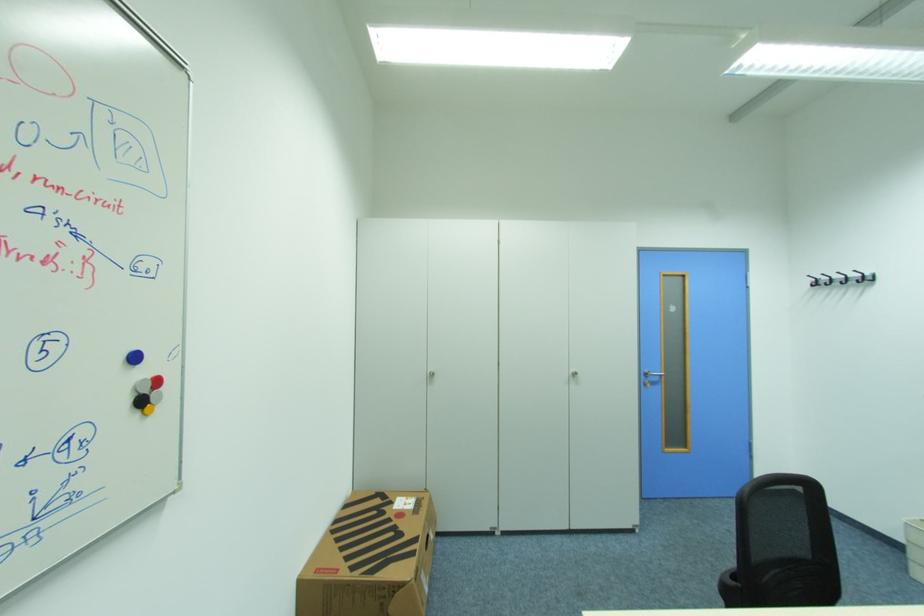
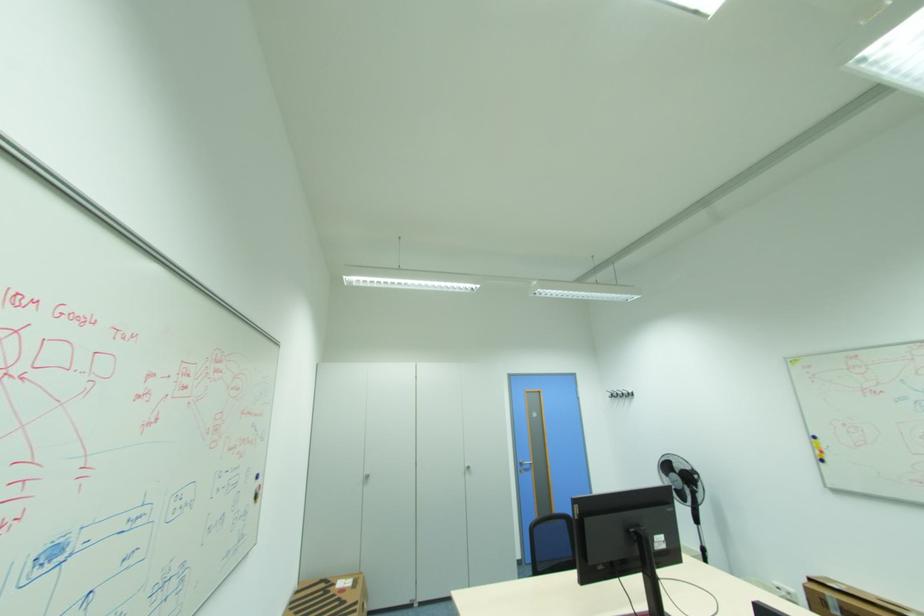
Question: I am providing you with two images of the same scene from different viewpoints. Which of the following objects are not visible in image2?

Choices:
 (A) silver door handle
 (B) silver cabinet handle
 (C) yellow whiteboard marker
 (D) none of these

Answer: (D)